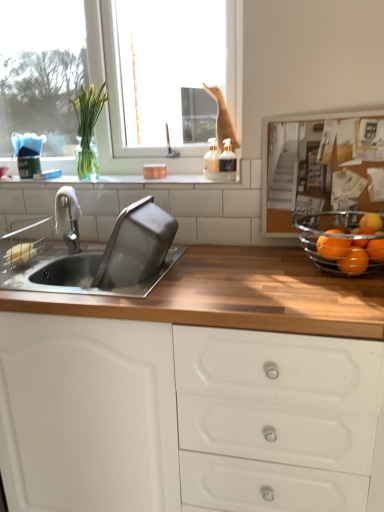
Question: Does orange matte/orange at right, which is the 3th orange in right-to-left order, have a smaller size compared to orange matte at right, the fourth orange viewed from the right?

Choices:
 (A) no
 (B) yes

Answer: (B)

Question: Is orange matte/orange at right, which is the 2th orange from left to right, closer to camera compared to orange matte at right, the fourth orange viewed from the right?

Choices:
 (A) no
 (B) yes

Answer: (A)

Question: Does orange matte/orange at right, which is the 3th orange in right-to-left order, contain orange matte at right, which ranks as the 1th orange in left-to-right order?

Choices:
 (A) no
 (B) yes

Answer: (A)

Question: From a real-world perspective, is orange matte/orange at right, which is the 3th orange in right-to-left order, positioned over orange matte at right, the fourth orange viewed from the right, based on gravity?

Choices:
 (A) yes
 (B) no

Answer: (B)

Question: Does orange matte/orange at right, which is the 2th orange from left to right, have a greater height compared to orange matte at right, the fourth orange viewed from the right?

Choices:
 (A) no
 (B) yes

Answer: (B)

Question: From the image's perspective, would you say orange matte/orange at right, which is the 2th orange from left to right, is shown under orange matte at right, which ranks as the 1th orange in left-to-right order?

Choices:
 (A) yes
 (B) no

Answer: (A)

Question: Does white tile at upper center lie in front of green glass vase at upper left?

Choices:
 (A) yes
 (B) no

Answer: (A)

Question: Can you confirm if white tile at upper center is positioned to the left of green glass vase at upper left?

Choices:
 (A) yes
 (B) no

Answer: (B)

Question: From the image's perspective, is white tile at upper center on green glass vase at upper left?

Choices:
 (A) no
 (B) yes

Answer: (A)

Question: Does white tile at upper center contain green glass vase at upper left?

Choices:
 (A) yes
 (B) no

Answer: (B)

Question: Is white tile at upper center looking in the opposite direction of green glass vase at upper left?

Choices:
 (A) no
 (B) yes

Answer: (A)

Question: Does white tile at upper center have a lesser height compared to green glass vase at upper left?

Choices:
 (A) yes
 (B) no

Answer: (A)

Question: Does orange matte at right, the 4th orange from the left, have a lesser width compared to orange matte/orange at right, which is the 2th orange from left to right?

Choices:
 (A) yes
 (B) no

Answer: (A)